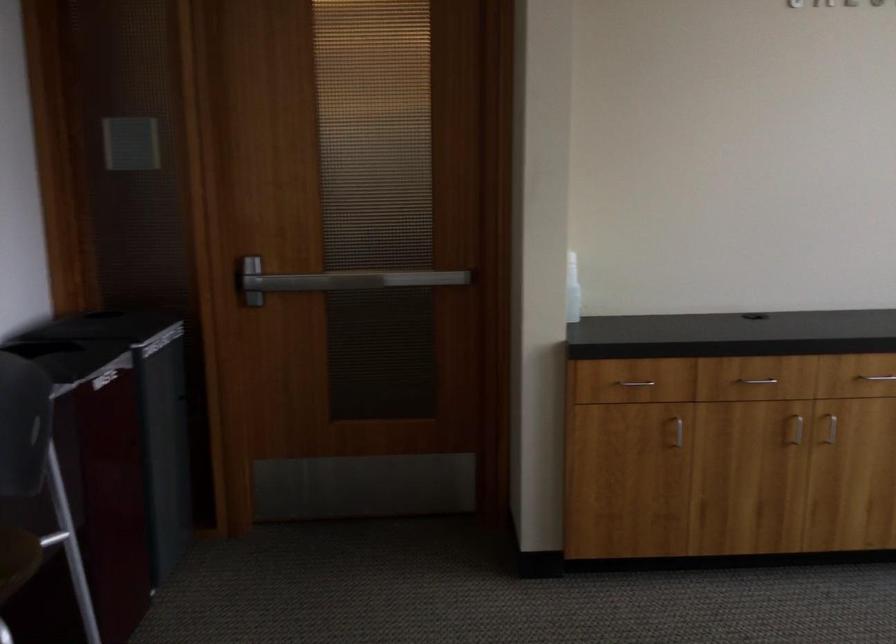
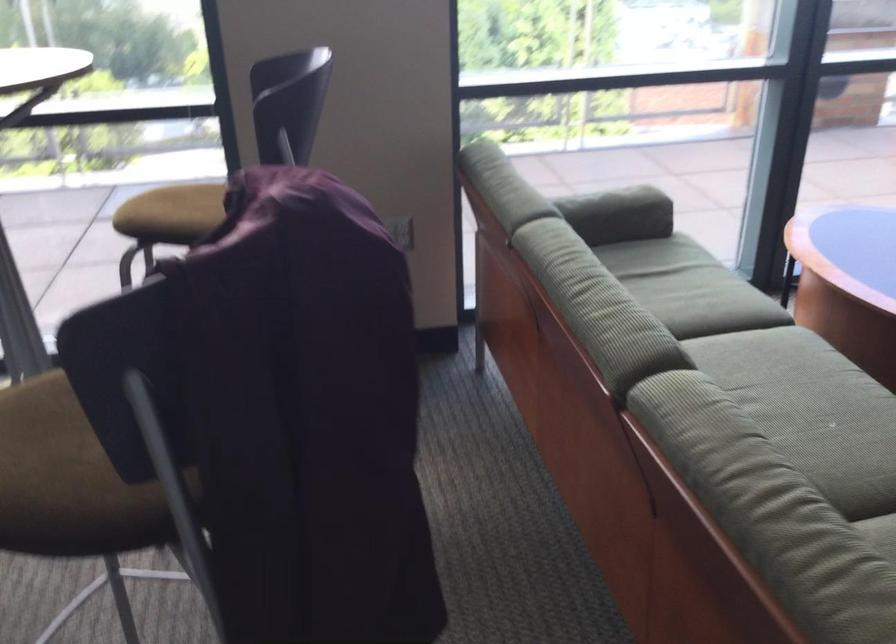
First-person continuous shooting, in which direction is the camera rotating?

The rotation direction of the camera is right-down.